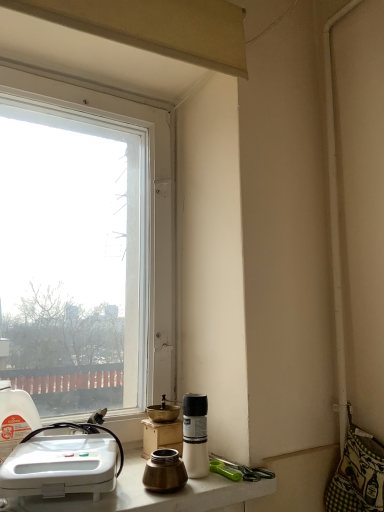
Image resolution: width=384 pixels, height=512 pixels. In order to click on vacant area to the left of brass metallic coffee cup at lower center in this screenshot , I will do `click(113, 492)`.